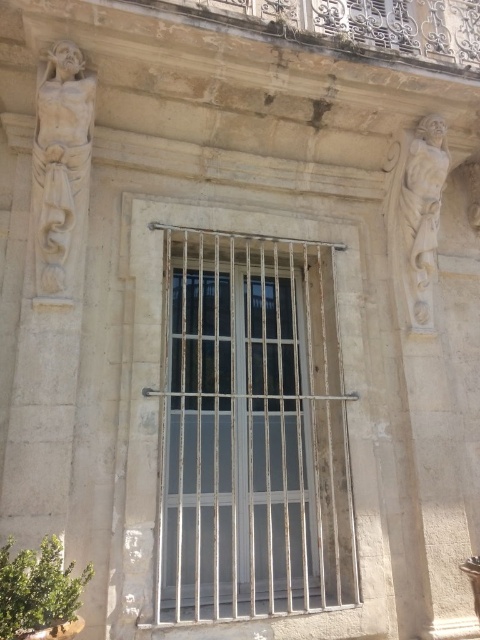
You are an art conservator examining the building facade. You need to clean both the metallic bars at center and the white marble statue at left. Which object should you clean first if you want to start with the one that is closer to you?

The metallic bars at center is in front of the white marble statue at left, so you should clean the metallic bars at center first since it is closer to you.

You are an architect examining the building facade. You see the metallic bars at center and the white marble statue at left. Which object is positioned to the right of the other?

The metallic bars at center is positioned to the right of the white marble statue at left.